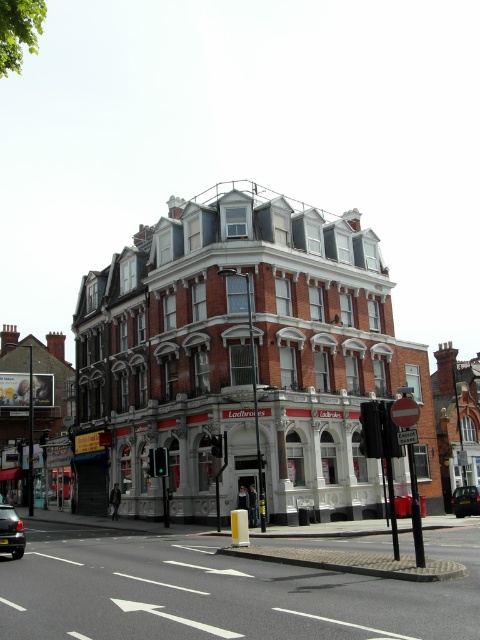
You are a pedestrian standing on the black asphalt road at center. You see a black metallic car at center. Which direction should you move to avoid the car?

The black asphalt road at center is positioned over the black metallic car at center, meaning the car is parked on the road. To avoid the car, you should move to either the left or right side of the road away from the black metallic car at center.

Consider the image. You are driving a car and need to park on the road. The black glossy car at center is already parked on the black asphalt road at center. Can your car fit alongside it without crossing the road edge?

The black asphalt road at center is wider than the black glossy car at center, so yes, your car can fit alongside it without crossing the road edge.

You are standing at the point with coordinates point (220, 593). What is the surface material under your feet?

The point (220, 593) corresponds to black asphalt road at center, so the surface material under your feet is black asphalt road.